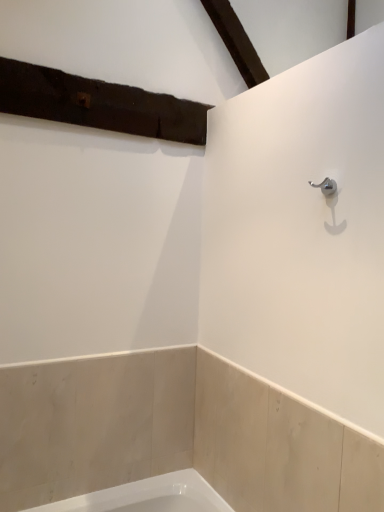
This screenshot has width=384, height=512. What do you see at coordinates (98, 104) in the screenshot?
I see `dark brown wood at upper left` at bounding box center [98, 104].

I want to click on dark brown wood at upper left, so pyautogui.click(x=98, y=104).

You are a GUI agent. You are given a task and a screenshot of the screen. Output one action in this format:
    pyautogui.click(x=<x>, y=<y>)
    Task: Click on the dark brown wood at upper left
    The height and width of the screenshot is (512, 384).
    Given the screenshot: What is the action you would take?
    pyautogui.click(x=98, y=104)